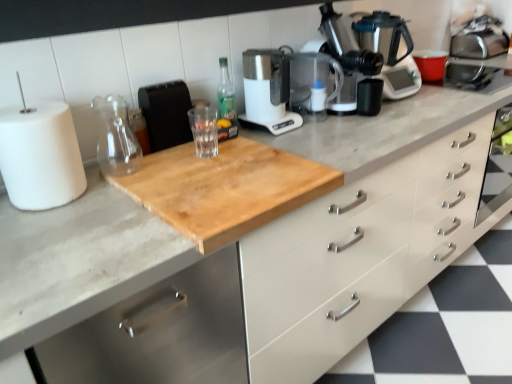
Identify the location of vacant area that lies in front of metallic silver coffee machine at upper right. This screenshot has width=512, height=384. (364, 125).